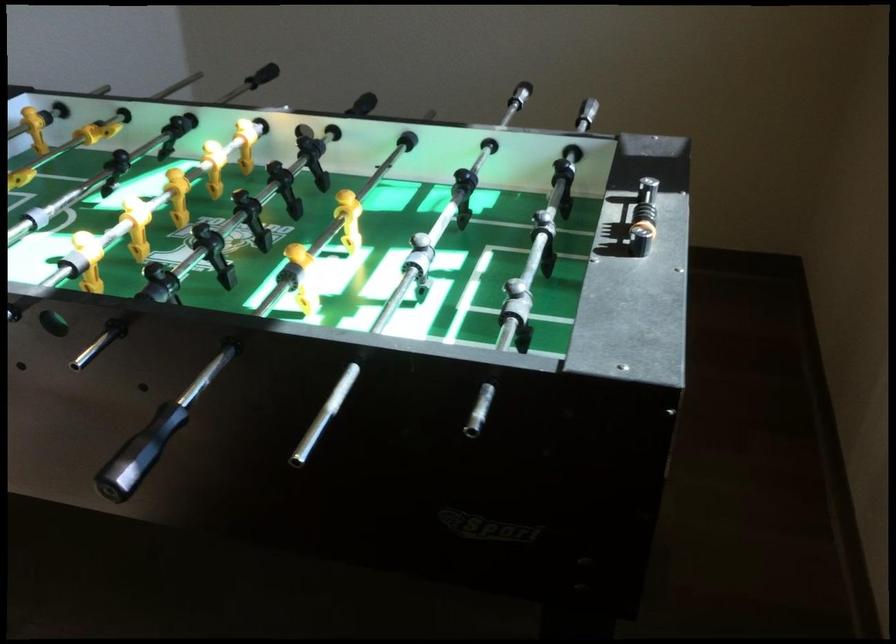
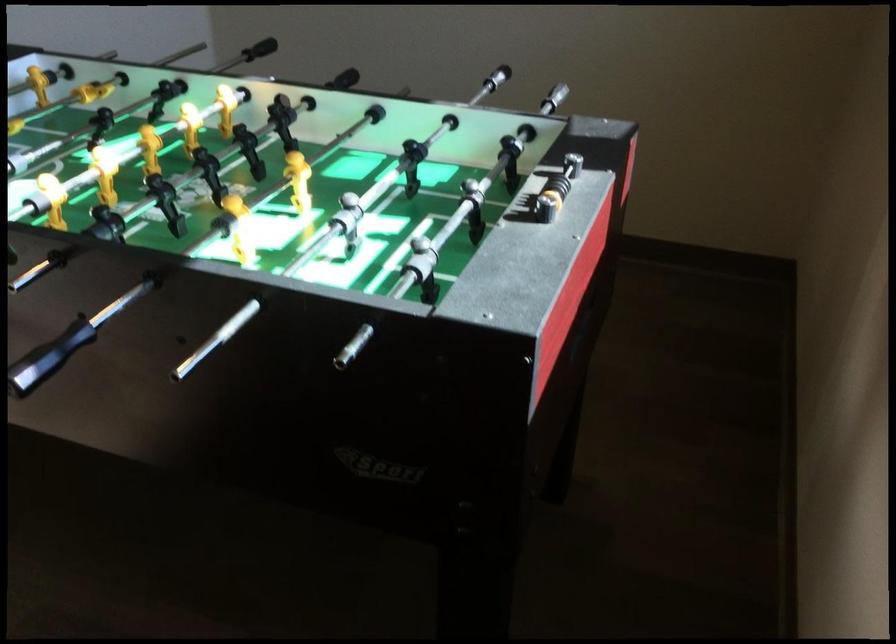
Locate, in the second image, the point that corresponds to [152,448] in the first image.

(48, 357)